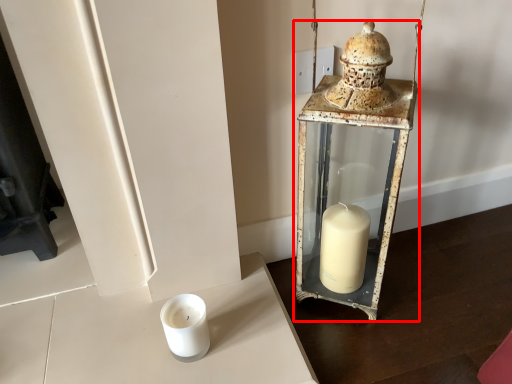
Question: From the image's perspective, considering the relative positions of lantern (annotated by the red box) and candle holder in the image provided, where is lantern (annotated by the red box) located with respect to the staircase?

Choices:
 (A) below
 (B) above

Answer: (B)